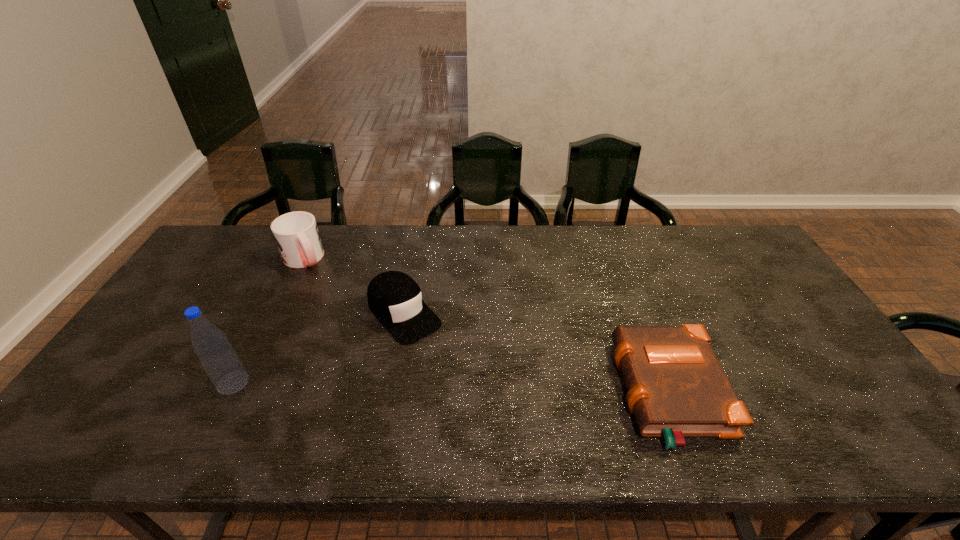
I want to click on free space on the desktop that is between the water bottle and the Bible and is positioned on the side of the third shortest object with the handle, so click(389, 387).

This screenshot has height=540, width=960. I want to click on vacant space on the desktop that is between the water bottle and the Bible and is positioned on the front-facing side of the second object from right to left, so click(x=472, y=388).